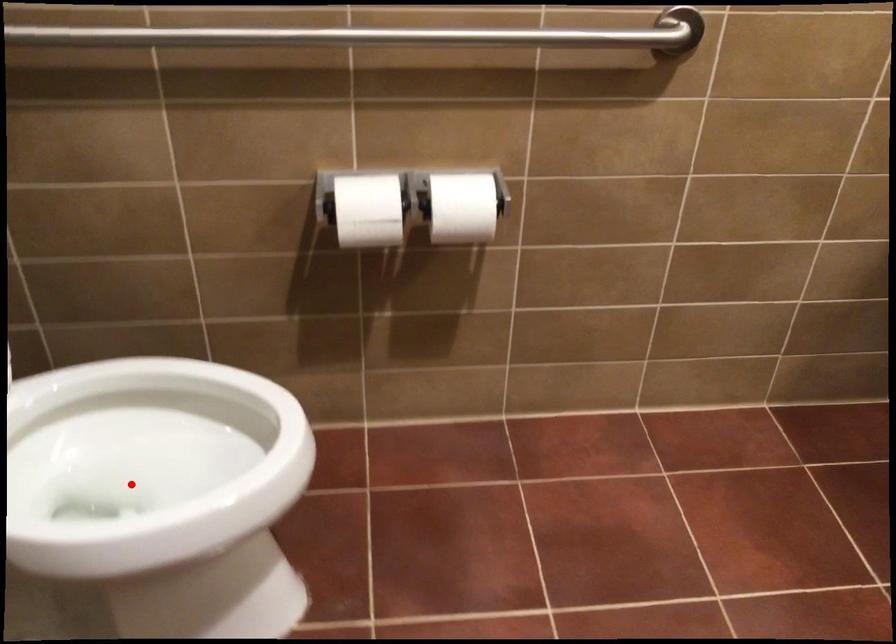
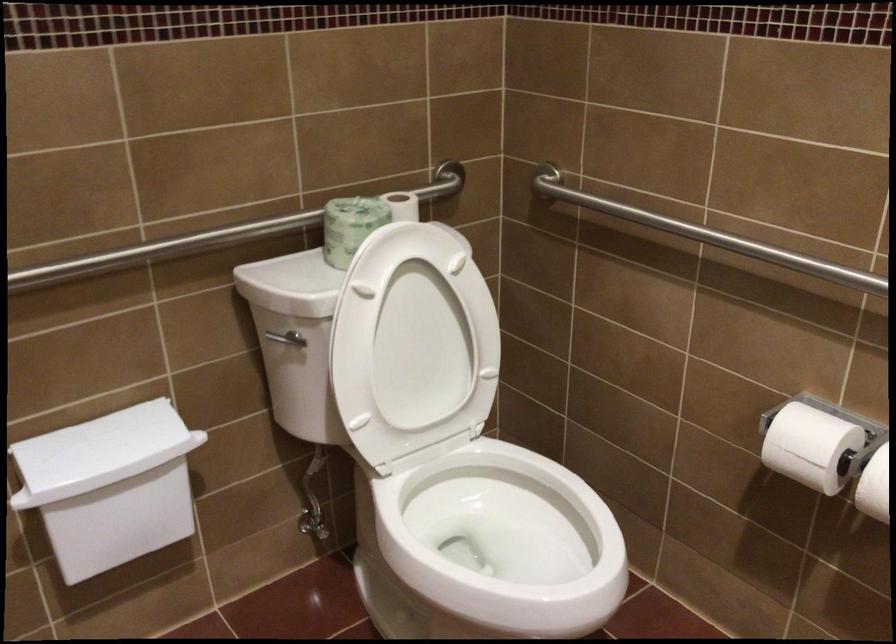
Question: I am providing you with two images of the same scene from different viewpoints. Given a red point in image1, look at the same physical point in image2. Is it:

Choices:
 (A) Closer to the viewpoint
 (B) Farther from the viewpoint

Answer: (B)